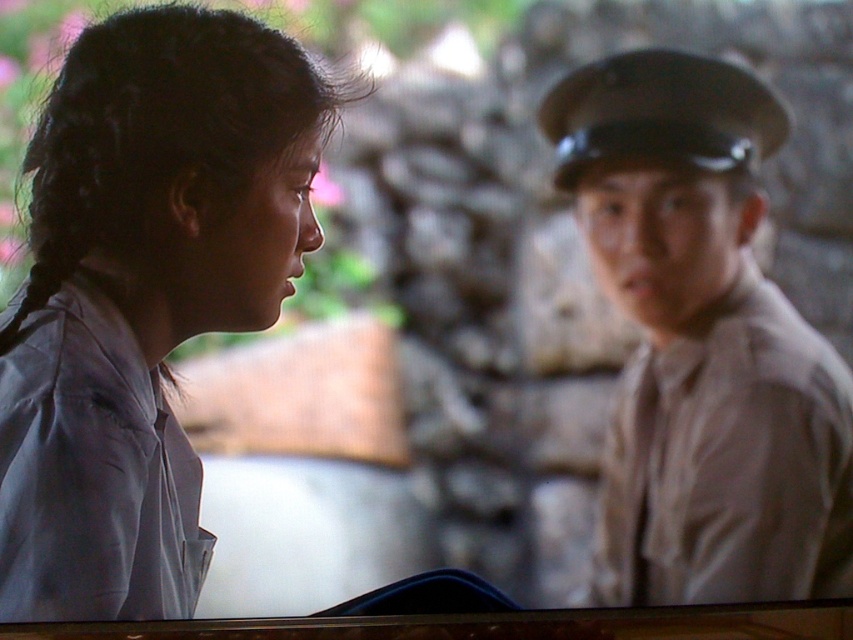
Is light brown uniform at right positioned in front of matte gray uniform at left?

No, light brown uniform at right is behind matte gray uniform at left.

The width and height of the screenshot is (853, 640). I want to click on light brown uniform at right, so click(701, 342).

Can you confirm if matte gray shirt at left is positioned above matte gray uniform at left?

Correct, matte gray shirt at left is located above matte gray uniform at left.

Does matte gray shirt at left come in front of matte gray uniform at left?

Yes, matte gray shirt at left is closer to the viewer.

Which is in front, point (61, 312) or point (33, 460)?

Point (33, 460) is in front.

Where is `matte gray shirt at left`? matte gray shirt at left is located at coordinates (142, 296).

Does matte gray shirt at left have a greater width compared to light brown uniform at right?

Correct, the width of matte gray shirt at left exceeds that of light brown uniform at right.

Is matte gray shirt at left above light brown uniform at right?

Yes.

The image size is (853, 640). I want to click on matte gray shirt at left, so click(x=142, y=296).